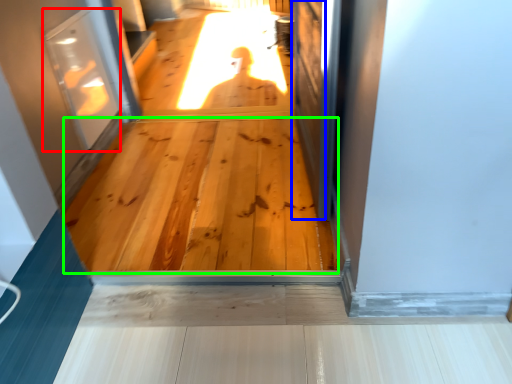
Question: Estimate the real-world distances between objects in this image. Which object is closer to screen door (highlighted by a red box), screen door (highlighted by a blue box) or hardwood (highlighted by a green box)?

Choices:
 (A) screen door
 (B) hardwood

Answer: (B)